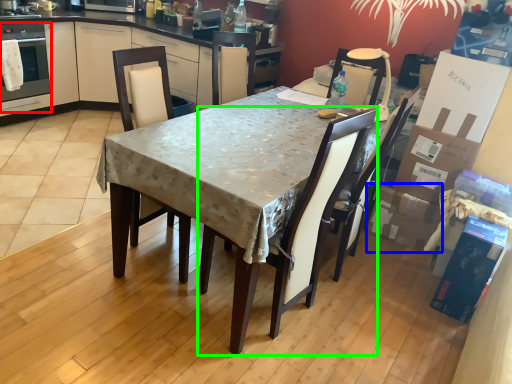
Question: Which object is positioned closest to oven (highlighted by a red box)? Select from cardboard box (highlighted by a blue box) and chair (highlighted by a green box).

Choices:
 (A) cardboard box
 (B) chair

Answer: (B)